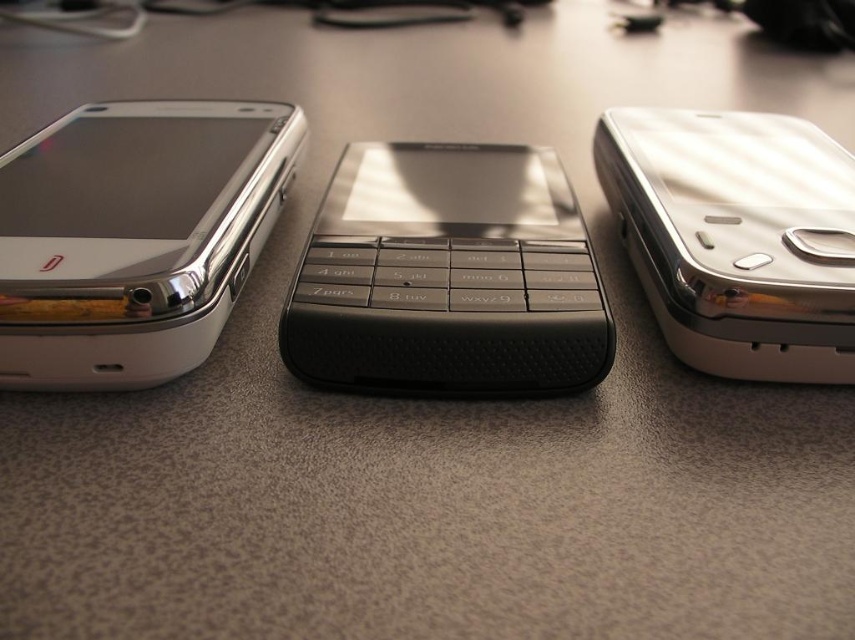
Is point (558, 330) closer to viewer compared to point (86, 124)?

Yes, point (558, 330) is closer to viewer.

How much distance is there between black textured keypad at center and matte silver smartphone at left?

black textured keypad at center and matte silver smartphone at left are 26.34 centimeters apart from each other.

What do you see at coordinates (447, 276) in the screenshot? This screenshot has height=640, width=855. I see `black textured keypad at center` at bounding box center [447, 276].

Identify the location of black textured keypad at center. (447, 276).

Does black textured keypad at center appear on the right side of metallic silver phone at right?

In fact, black textured keypad at center is to the left of metallic silver phone at right.

Between point (549, 352) and point (808, 312), which one is positioned in front?

Point (808, 312) is in front.

Based on the photo, measure the distance between point (391, 364) and camera.

Point (391, 364) is 35.43 inches away from camera.

Identify the location of black textured keypad at center. (447, 276).

Is matte silver smartphone at left below metallic silver phone at right?

Incorrect, matte silver smartphone at left is not positioned below metallic silver phone at right.

Between point (152, 371) and point (632, 241), which one is positioned in front?

Point (152, 371) is in front.

Is point (68, 314) more distant than point (758, 269)?

That is False.

You are a GUI agent. You are given a task and a screenshot of the screen. Output one action in this format:
    pyautogui.click(x=<x>, y=<y>)
    Task: Click on the matte silver smartphone at left
    Image resolution: width=855 pixels, height=640 pixels.
    Given the screenshot: What is the action you would take?
    pyautogui.click(x=134, y=236)